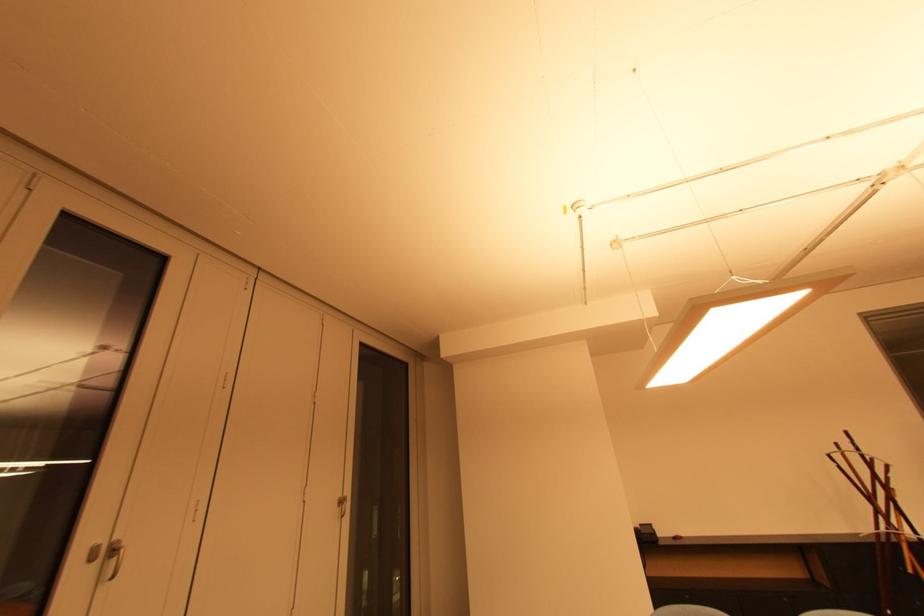
Describe the element at coordinates (342, 505) in the screenshot. I see `a small cabinet handle` at that location.